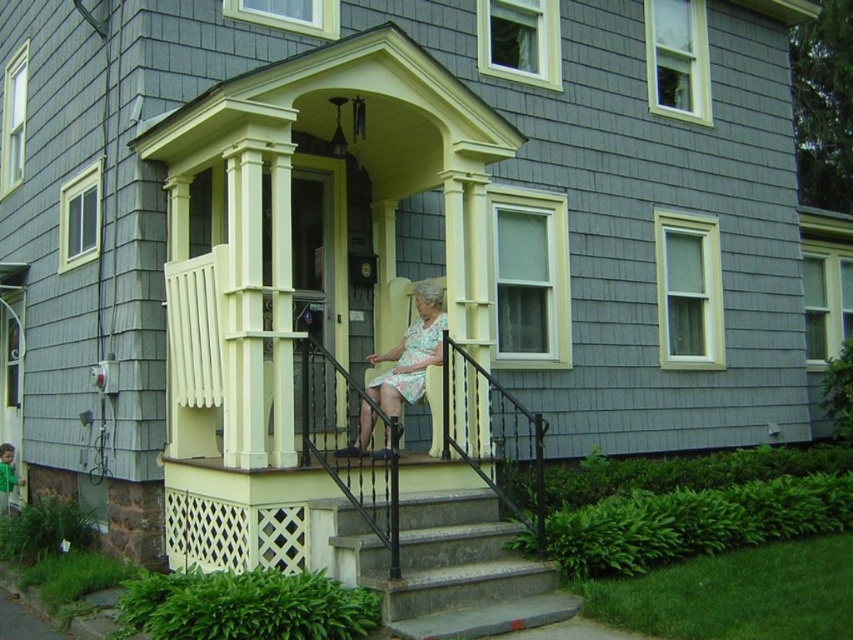
Can you confirm if concrete steps at center is smaller than floral fabric dress at center?

Correct, concrete steps at center occupies less space than floral fabric dress at center.

Between concrete steps at center and floral fabric dress at center, which one appears on the right side from the viewer's perspective?

From the viewer's perspective, concrete steps at center appears more on the right side.

Image resolution: width=853 pixels, height=640 pixels. I want to click on concrete steps at center, so [x=442, y=566].

In order to click on concrete steps at center in this screenshot , I will do `click(442, 566)`.

Who is shorter, concrete steps at center or floral print fabric dress at center?

With less height is concrete steps at center.

Can you confirm if concrete steps at center is positioned to the left of floral print fabric dress at center?

Incorrect, concrete steps at center is not on the left side of floral print fabric dress at center.

At what (x,y) coordinates should I click in order to perform the action: click on concrete steps at center. Please return your answer as a coordinate pair (x, y). The image size is (853, 640). Looking at the image, I should click on (442, 566).

Locate an element on the screen. This screenshot has width=853, height=640. concrete steps at center is located at coordinates (442, 566).

Who is shorter, floral fabric dress at center or floral print fabric dress at center?

Standing shorter between the two is floral print fabric dress at center.

Is floral fabric dress at center to the right of floral print fabric dress at center from the viewer's perspective?

Incorrect, floral fabric dress at center is not on the right side of floral print fabric dress at center.

At what (x,y) coordinates should I click in order to perform the action: click on floral fabric dress at center. Please return your answer as a coordinate pair (x, y). The image size is (853, 640). Looking at the image, I should click on (410, 353).